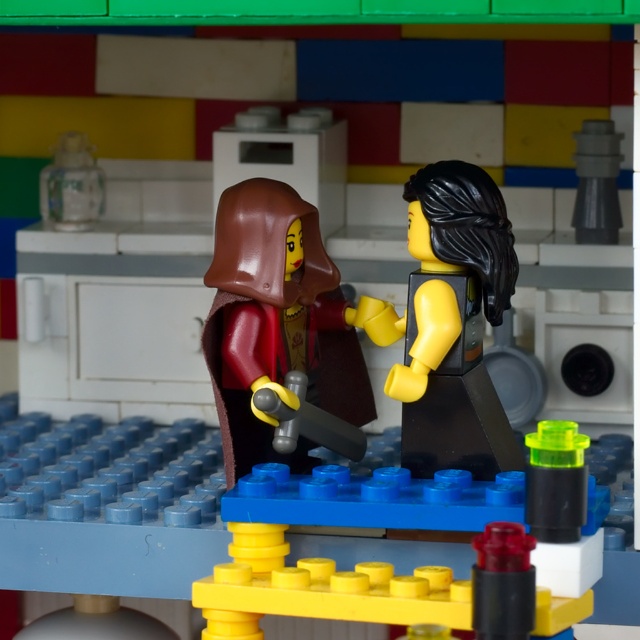
Between smooth brown cape at center and smooth black minifigure at center, which one is positioned lower?

Positioned lower is smooth brown cape at center.

What do you see at coordinates (276, 323) in the screenshot? The image size is (640, 640). I see `smooth brown cape at center` at bounding box center [276, 323].

The width and height of the screenshot is (640, 640). Identify the location of smooth brown cape at center. (276, 323).